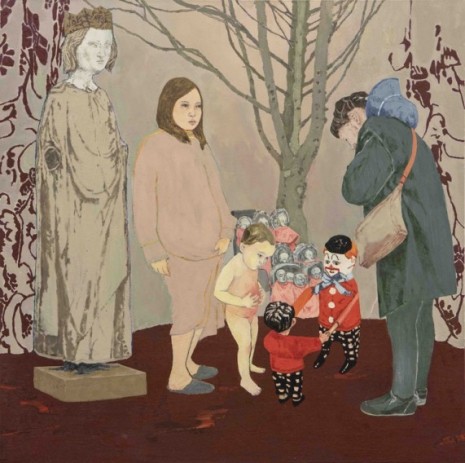
The width and height of the screenshot is (465, 463). Find the location of `statue`. statue is located at coordinates (101, 145), (99, 23).